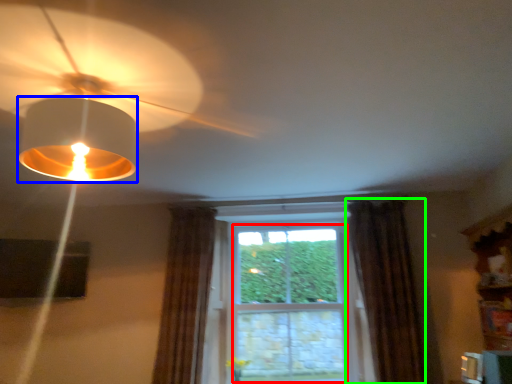
Question: Considering the real-world distances, which object is closest to bay window (highlighted by a red box)? lamp (highlighted by a blue box) or curtain (highlighted by a green box).

Choices:
 (A) lamp
 (B) curtain

Answer: (B)